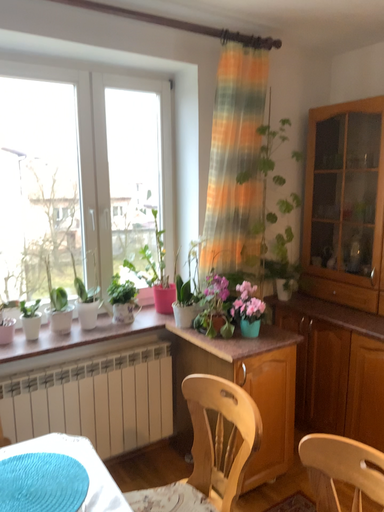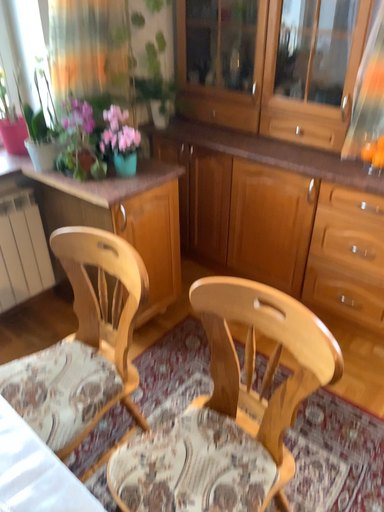
Question: Which way did the camera rotate in the video?

Choices:
 (A) rotated downward
 (B) rotated upward

Answer: (A)